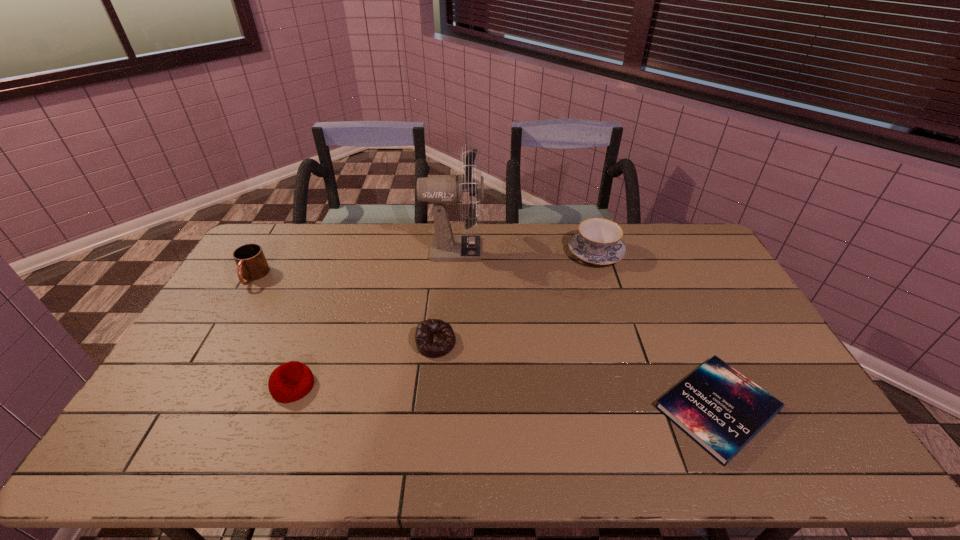
Where is `object that is at the near right corner`? The height and width of the screenshot is (540, 960). object that is at the near right corner is located at coordinates (718, 407).

Identify the location of vacant space at the far edge of the desktop. (631, 226).

At what (x,y) coordinates should I click in order to perform the action: click on free point at the near edge. Please return your answer as a coordinate pair (x, y). Looking at the image, I should click on (431, 444).

Find the location of a particular element. The image size is (960, 540). vacant space at the left edge of the desktop is located at coordinates (176, 423).

Where is `vacant space at the right edge of the desktop`? This screenshot has height=540, width=960. vacant space at the right edge of the desktop is located at coordinates (701, 295).

The height and width of the screenshot is (540, 960). In order to click on vacant space at the far right corner of the desktop in this screenshot , I will do `click(673, 224)`.

You are a GUI agent. You are given a task and a screenshot of the screen. Output one action in this format:
    pyautogui.click(x=<x>, y=<y>)
    Task: Click on the vacant area that lies between the nearer beanbag and the leftmost object
    The image size is (960, 540).
    Given the screenshot: What is the action you would take?
    pyautogui.click(x=274, y=332)

I want to click on vacant space in between the leftmost object and the second shortest object, so click(x=345, y=310).

The image size is (960, 540). What are the coordinates of `free area in between the shortest object and the tallest object` in the screenshot? It's located at (586, 329).

At what (x,y) coordinates should I click in order to perform the action: click on empty location between the tallest object and the fourth farthest object. Please return your answer as a coordinate pair (x, y). Image resolution: width=960 pixels, height=540 pixels. Looking at the image, I should click on (444, 296).